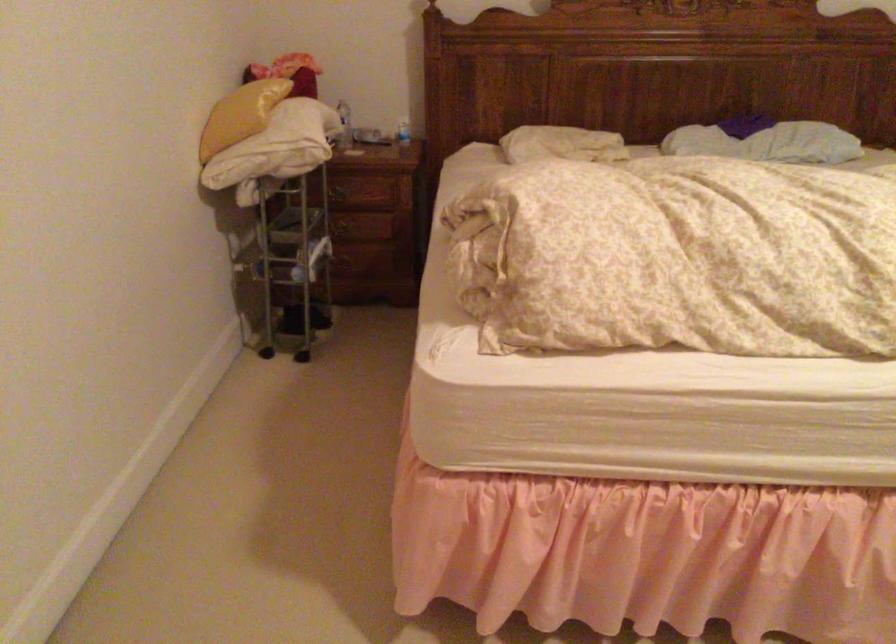
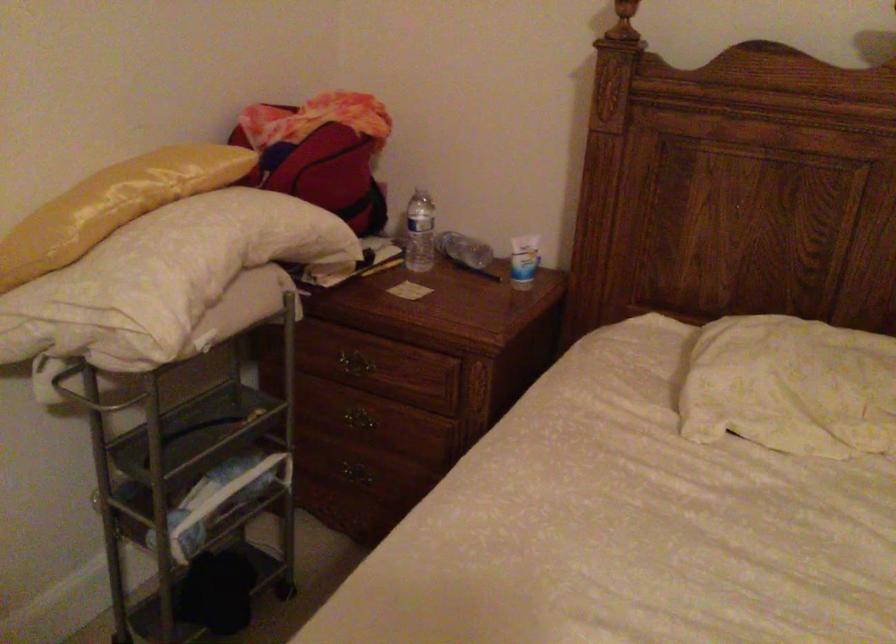
The point at (412, 125) is marked in the first image. Where is the corresponding point in the second image?

(523, 261)